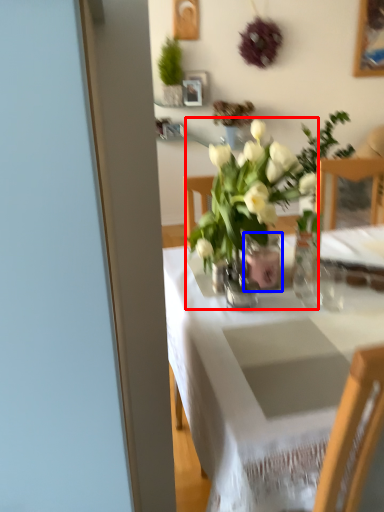
Question: Which point is further to the camera, houseplant (highlighted by a red box) or vase (highlighted by a blue box)?

Choices:
 (A) houseplant
 (B) vase

Answer: (B)